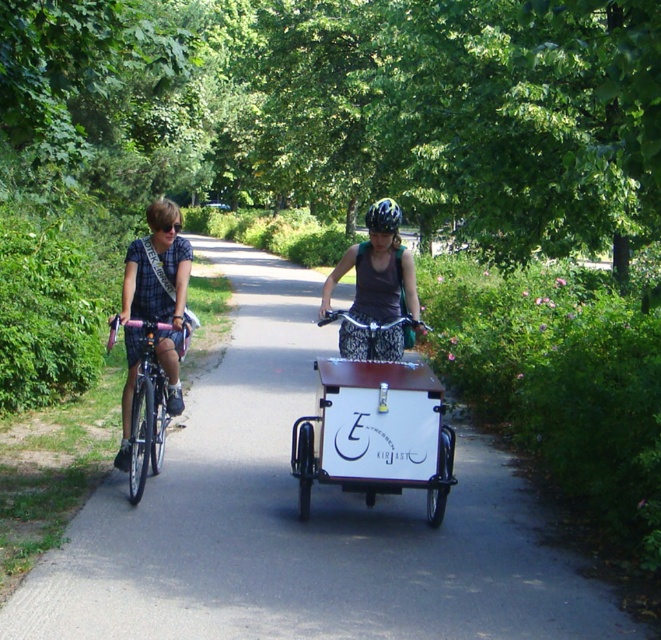
You are a pedestrian walking along the path and want to cross to the opposite side. The path is narrow, and you notice the white matte cargo bike at center and the shiny metallic bicycle at left. Which bicycle should you wait behind to safely cross without obstructing their path?

You should wait behind the shiny metallic bicycle at left because the white matte cargo bike at center is to the right of it, meaning the shiny metallic bicycle at left is closer to you. By waiting behind the closer bicycle, you can ensure a safer crossing without blocking their path.

You are standing at the starting point of the path and want to reach the point closer to you. Which point should you head towards, point (x=332, y=269) or point (x=391, y=214)?

You should head towards point (x=332, y=269) because it is closer to you than point (x=391, y=214).

You are standing at the center of the path in the park. You want to find the shiny metallic bicycle at left. Which direction should you look to locate it?

You should look to your left to locate the shiny metallic bicycle at left since it is positioned at the left side of the path.